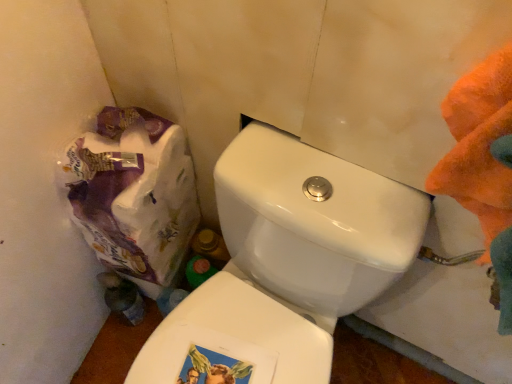
What is the approximate width of white glossy toilet at center?

19.92 inches.

Measure the distance between white glossy toilet at center and camera.

white glossy toilet at center and camera are 25.40 inches apart.

The width and height of the screenshot is (512, 384). Identify the location of white glossy toilet at center. (289, 260).

What do you see at coordinates (289, 260) in the screenshot? I see `white glossy toilet at center` at bounding box center [289, 260].

The height and width of the screenshot is (384, 512). Describe the element at coordinates (134, 193) in the screenshot. I see `white paper bag at lower left` at that location.

The width and height of the screenshot is (512, 384). I want to click on white paper bag at lower left, so click(x=134, y=193).

What is the approximate width of white paper bag at lower left?

white paper bag at lower left is 9.41 inches wide.

The image size is (512, 384). I want to click on white glossy toilet at center, so click(289, 260).

Based on the photo, which is more to the left, white glossy toilet at center or white paper bag at lower left?

white paper bag at lower left.

Which is behind, white glossy toilet at center or white paper bag at lower left?

white paper bag at lower left is behind.

Is point (298, 154) closer to camera compared to point (121, 144)?

Yes, it is in front of point (121, 144).

From the image's perspective, between white glossy toilet at center and white paper bag at lower left, which one is located above?

white paper bag at lower left.

From a real-world perspective, between white glossy toilet at center and white paper bag at lower left, who is vertically lower?

white glossy toilet at center, from a real-world perspective.

In the scene shown: Is white glossy toilet at center wider than white paper bag at lower left?

Yes, white glossy toilet at center is wider than white paper bag at lower left.

Is white glossy toilet at center shorter than white paper bag at lower left?

No, white glossy toilet at center is not shorter than white paper bag at lower left.

Considering the sizes of objects white glossy toilet at center and white paper bag at lower left in the image provided, who is smaller, white glossy toilet at center or white paper bag at lower left?

white paper bag at lower left is smaller.

Is white glossy toilet at center completely or partially outside of white paper bag at lower left?

Yes, white glossy toilet at center is not within white paper bag at lower left.

Is white glossy toilet at center not near white paper bag at lower left?

white glossy toilet at center is actually quite close to white paper bag at lower left.

Could you tell me if white glossy toilet at center is turned towards white paper bag at lower left?

No, white glossy toilet at center is not aimed at white paper bag at lower left.

What's the angular difference between white glossy toilet at center and white paper bag at lower left's facing directions?

7.08 degrees.

How far apart are white glossy toilet at center and white paper bag at lower left?

The distance of white glossy toilet at center from white paper bag at lower left is 9.64 inches.

Where is `toilet below the white paper bag at lower left (from a real-world perspective)`? This screenshot has width=512, height=384. toilet below the white paper bag at lower left (from a real-world perspective) is located at coordinates (289, 260).

Consider the image. Considering the positions of objects white paper bag at lower left and white glossy toilet at center in the image provided, who is more to the right, white paper bag at lower left or white glossy toilet at center?

Positioned to the right is white glossy toilet at center.

Between white paper bag at lower left and white glossy toilet at center, which one is positioned in front?

white glossy toilet at center.

Does point (116, 259) lie behind point (290, 330)?

Yes, it is.

From the image's perspective, is white paper bag at lower left above white glossy toilet at center?

Yes, from the image's perspective, white paper bag at lower left is above white glossy toilet at center.

In the scene shown: From a real-world perspective, relative to white glossy toilet at center, is white paper bag at lower left vertically above or below?

white paper bag at lower left is situated higher than white glossy toilet at center in the real world.

Is white paper bag at lower left thinner than white glossy toilet at center?

Yes, white paper bag at lower left is thinner than white glossy toilet at center.

Does white paper bag at lower left have a lesser height compared to white glossy toilet at center?

Correct, white paper bag at lower left is not as tall as white glossy toilet at center.

Between white paper bag at lower left and white glossy toilet at center, which one has smaller size?

With smaller size is white paper bag at lower left.

Is white paper bag at lower left situated inside white glossy toilet at center or outside?

white paper bag at lower left exists outside the volume of white glossy toilet at center.

Is white paper bag at lower left in contact with white glossy toilet at center?

No, white paper bag at lower left is not making contact with white glossy toilet at center.

Consider the image. Is white paper bag at lower left oriented away from white glossy toilet at center?

No.

Measure the distance between white paper bag at lower left and white glossy toilet at center.

white paper bag at lower left and white glossy toilet at center are 24.49 centimeters apart.

I want to click on paper bag that appears above the white glossy toilet at center (from a real-world perspective), so (134, 193).

At what (x,y) coordinates should I click in order to perform the action: click on paper bag above the white glossy toilet at center (from the image's perspective). Please return your answer as a coordinate pair (x, y). This screenshot has width=512, height=384. Looking at the image, I should click on (134, 193).

This screenshot has width=512, height=384. In order to click on paper bag to the left of white glossy toilet at center in this screenshot , I will do (x=134, y=193).